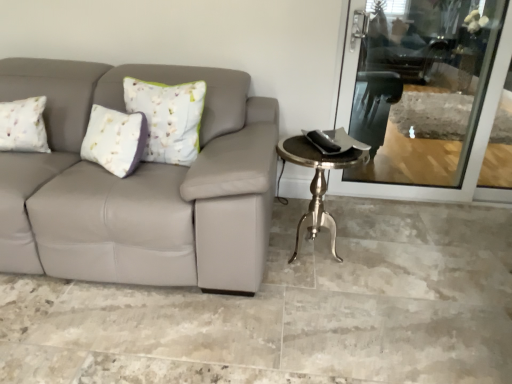
The height and width of the screenshot is (384, 512). Find the location of `vacant space situated above silver metallic table at right (from a real-world perspective)`. vacant space situated above silver metallic table at right (from a real-world perspective) is located at coordinates (325, 145).